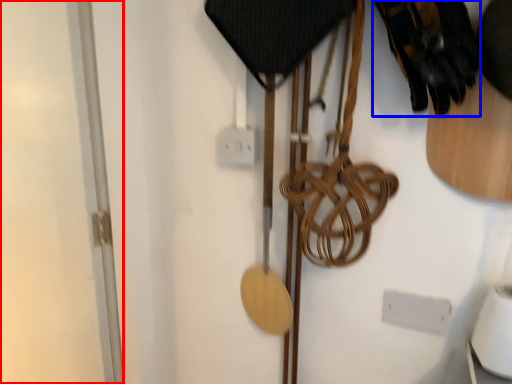
Question: Which point is further to the camera, glass door (highlighted by a red box) or footwear (highlighted by a blue box)?

Choices:
 (A) glass door
 (B) footwear

Answer: (A)